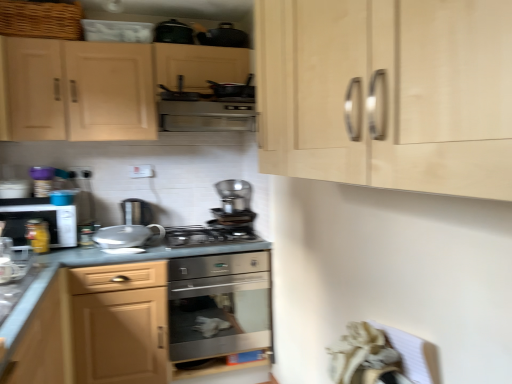
Question: Is stainless steel gas stove at center spatially inside satin wood cabinet at lower center, the first cabinetry when ordered from bottom to top, or outside of it?

Choices:
 (A) inside
 (B) outside

Answer: (B)

Question: Considering the positions of stainless steel gas stove at center and satin wood cabinet at lower center, the first cabinetry when ordered from bottom to top, in the image, is stainless steel gas stove at center bigger or smaller than satin wood cabinet at lower center, the first cabinetry when ordered from bottom to top,?

Choices:
 (A) small
 (B) big

Answer: (A)

Question: Based on their relative distances, which object is nearer to the stainless steel gas stove at center?

Choices:
 (A) stainless steel oven at center
 (B) metallic silver frying pan at upper center, the 7th appliance ordered from the bottom
 (C) satin wood cabinet at lower center, the first cabinetry when ordered from bottom to top
 (D) matte wood drawer at lower left, positioned as the 3th cabinetry in top-to-bottom order
 (E) light wood cabinet at upper left, the fourth cabinetry positioned from the bottom

Answer: (A)

Question: Which object is positioned farthest from the matte wood drawer at lower left, positioned as the 3th cabinetry in top-to-bottom order?

Choices:
 (A) light wood cabinet at upper right, acting as the 3th cabinetry starting from the bottom
 (B) matte white microwave at left, which appears as the 6th appliance when ordered from the bottom
 (C) woven wicker basket at upper left
 (D) satin silver coffee maker at center, positioned as the second appliance in right-to-left order
 (E) metallic silver frying pan at upper center, the 7th appliance viewed from the left

Answer: (E)